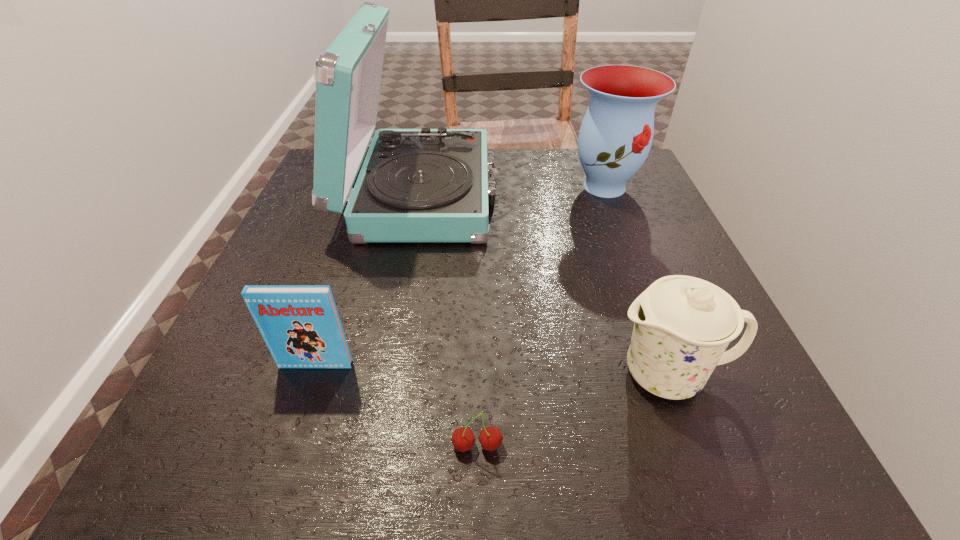
At what (x,y) coordinates should I click in order to perform the action: click on object at the far right corner. Please return your answer as a coordinate pair (x, y). Looking at the image, I should click on (615, 137).

Identify the location of vacant space at the far edge. Image resolution: width=960 pixels, height=540 pixels. (508, 149).

Where is `vacant region at the near edge of the desktop`? This screenshot has height=540, width=960. vacant region at the near edge of the desktop is located at coordinates (510, 418).

Where is `vacant region at the left edge`? The width and height of the screenshot is (960, 540). vacant region at the left edge is located at coordinates (292, 387).

In the image, there is a desktop. Where is `vacant area at the right edge`? This screenshot has height=540, width=960. vacant area at the right edge is located at coordinates (605, 218).

Find the location of a particular element. This screenshot has width=960, height=540. free space at the near left corner of the desktop is located at coordinates (213, 426).

Where is `vacant space at the near right corner of the desktop`? This screenshot has width=960, height=540. vacant space at the near right corner of the desktop is located at coordinates (696, 437).

The image size is (960, 540). Identify the location of unoccupied area between the cherry and the second tallest object. (540, 316).

This screenshot has width=960, height=540. What are the coordinates of `empty space between the record player and the book` in the screenshot? It's located at (369, 279).

Identify the location of unoccupied area between the book and the chinaware. (492, 369).